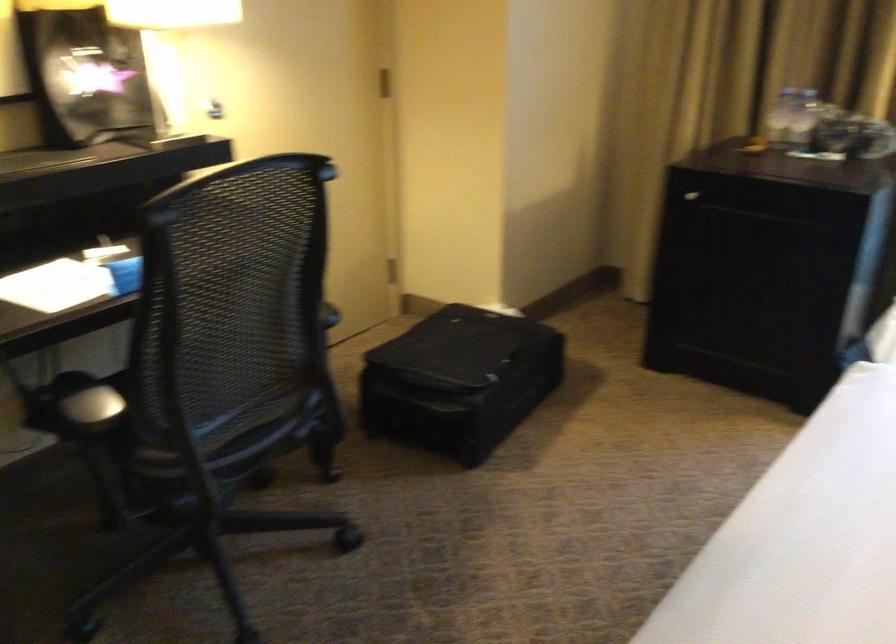
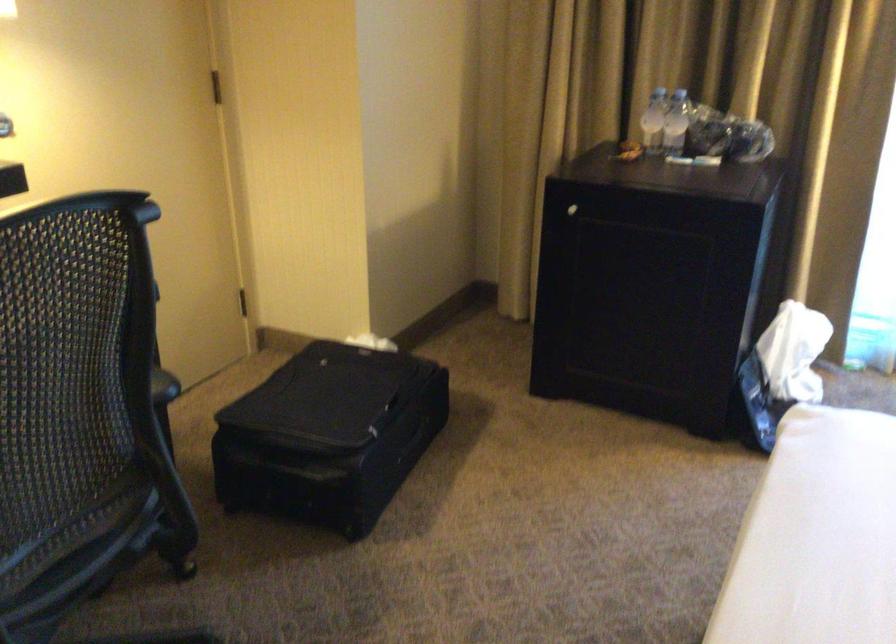
The point at (778, 117) is marked in the first image. Where is the corresponding point in the second image?

(653, 120)